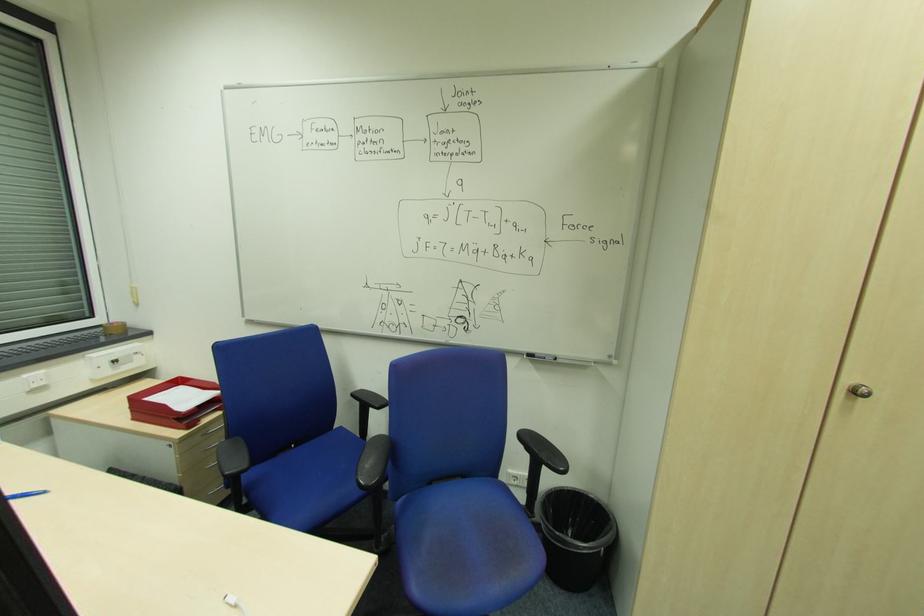
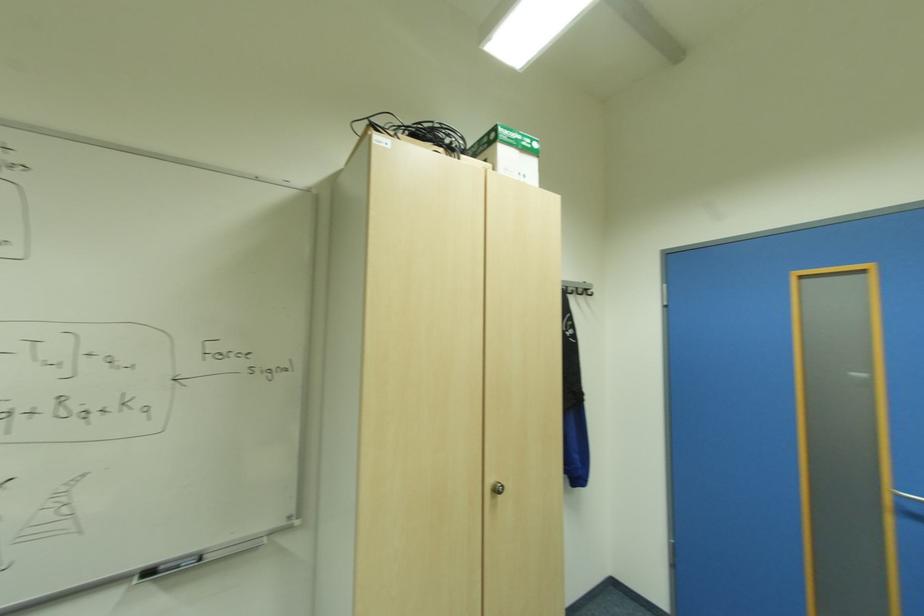
Question: Based on the continuous images, in which direction is the camera rotating? Reply with the corresponding letter.

Choices:
 (A) Left
 (B) Right
 (C) Up
 (D) Down

Answer: (B)